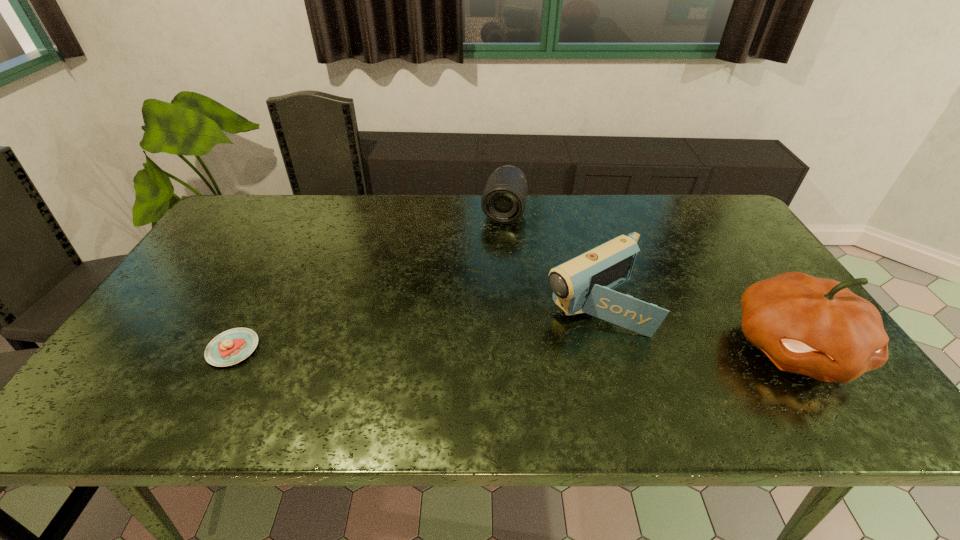
Image resolution: width=960 pixels, height=540 pixels. Identify the location of free space located 0.170m on the side of the camcorder with the flip-out screen. (501, 353).

At what (x,y) coordinates should I click in order to perform the action: click on vacant area situated on the surface of the telephoto lens. Please return your answer as a coordinate pair (x, y). Image resolution: width=960 pixels, height=540 pixels. Looking at the image, I should click on (489, 281).

Find the location of a particular element. This screenshot has width=960, height=540. vacant space situated on the surface of the telephoto lens is located at coordinates (492, 265).

At what (x,y) coordinates should I click in order to perform the action: click on vacant position located on the surface of the telephoto lens. Please return your answer as a coordinate pair (x, y). The height and width of the screenshot is (540, 960). Looking at the image, I should click on click(x=491, y=274).

Where is `object at the far edge`? object at the far edge is located at coordinates (503, 201).

At what (x,y) coordinates should I click in order to perform the action: click on pastry that is positioned at the near edge. Please return your answer as a coordinate pair (x, y). Image resolution: width=960 pixels, height=540 pixels. Looking at the image, I should click on (232, 346).

The height and width of the screenshot is (540, 960). What are the coordinates of `pumpkin at the near edge` in the screenshot? It's located at (817, 327).

I want to click on object that is at the right edge, so click(x=817, y=327).

Where is `object located at the near right corner`? object located at the near right corner is located at coordinates (817, 327).

In the image, there is a desktop. Find the location of `free region at the far edge`. free region at the far edge is located at coordinates (545, 219).